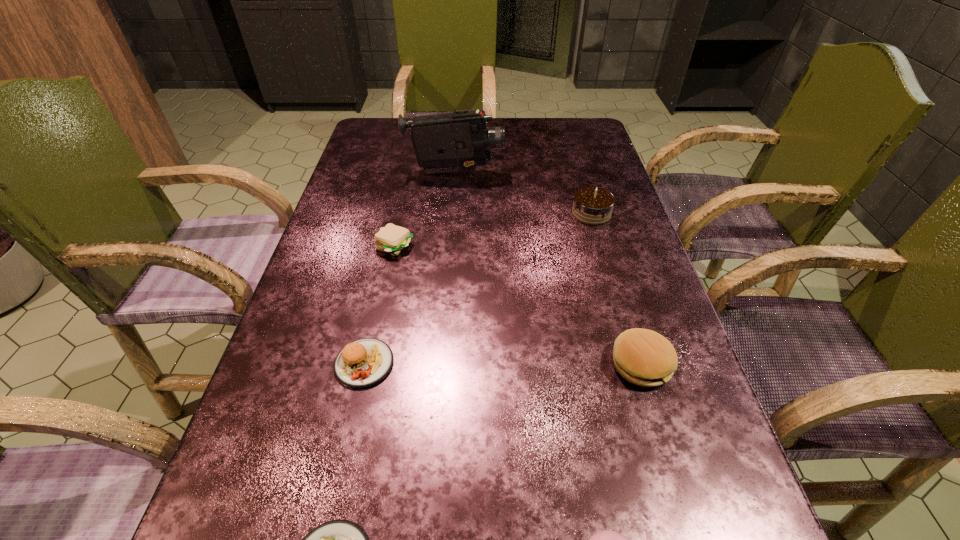
I want to click on free area in between the farthest patty (food) and the rightmost patty (food), so (x=517, y=305).

You are a GUI agent. You are given a task and a screenshot of the screen. Output one action in this format:
    pyautogui.click(x=<x>, y=<y>)
    Task: Click on the vacant space in between the rightmost patty (food) and the fifth nearest object
    
    Given the screenshot: What is the action you would take?
    pyautogui.click(x=517, y=305)

Image resolution: width=960 pixels, height=540 pixels. I want to click on free space between the second shortest patty (food) and the second tallest object, so (493, 230).

The width and height of the screenshot is (960, 540). I want to click on vacant space in between the chocolate cake and the rightmost patty (food), so click(616, 288).

Find the location of `object that stands as the third closest to the rightmost patty (food)`. object that stands as the third closest to the rightmost patty (food) is located at coordinates (362, 363).

Locate which object is the third closest to the sixth shortest object. Please provide its 2D coordinates. Your answer should be formatted as a tuple, i.e. [(x, y)], where the tuple contains the x and y coordinates of a point satisfying the conditions above.

[(392, 239)]

You are a GUI agent. You are given a task and a screenshot of the screen. Output one action in this format:
    pyautogui.click(x=<x>, y=<y>)
    Task: Click on the third closest patty (food) relative to the tallest object
    This screenshot has width=960, height=540.
    Given the screenshot: What is the action you would take?
    pyautogui.click(x=643, y=357)

I want to click on patty (food) object that ranks as the closest to the fifth object from left to right, so click(643, 357).

You are a GUI agent. You are given a task and a screenshot of the screen. Output one action in this format:
    pyautogui.click(x=<x>, y=<y>)
    Task: Click on the vacant space that satisfies the following two spatial constraints: 1. on the front-facing side of the sixth nearest object; 2. on the right side of the camcorder
    This screenshot has height=540, width=960.
    Given the screenshot: What is the action you would take?
    click(452, 213)